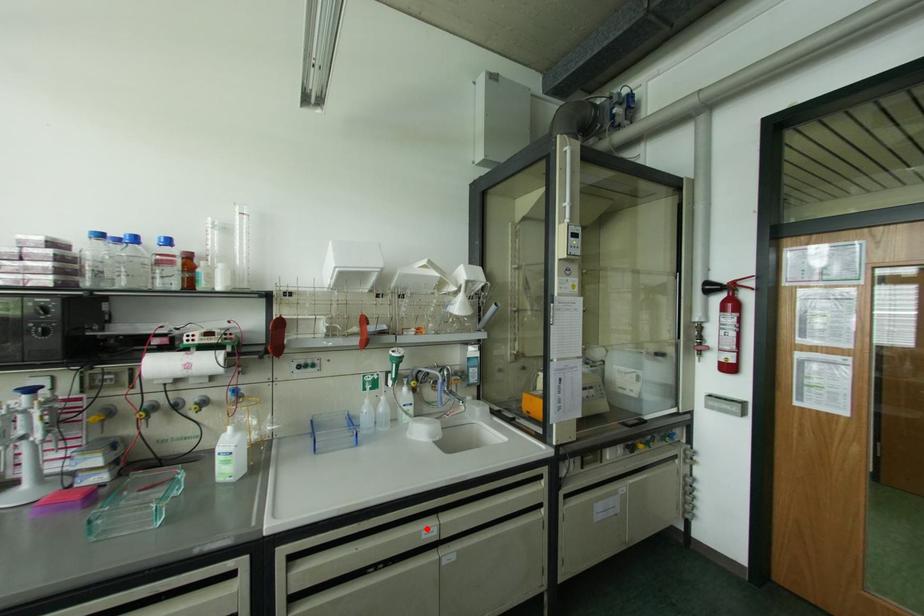
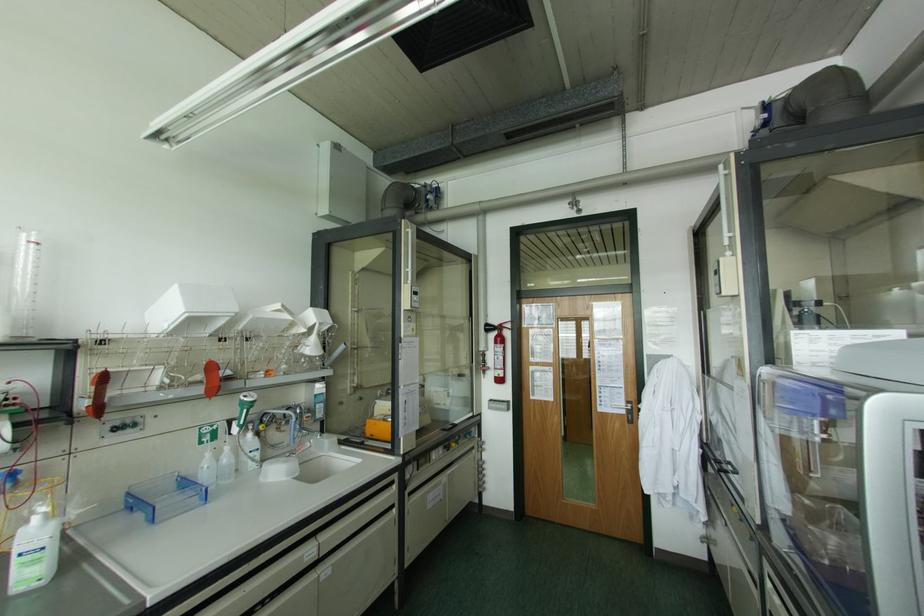
Where in the second image is the point corresponding to the highlighted location from the first image?

(308, 552)